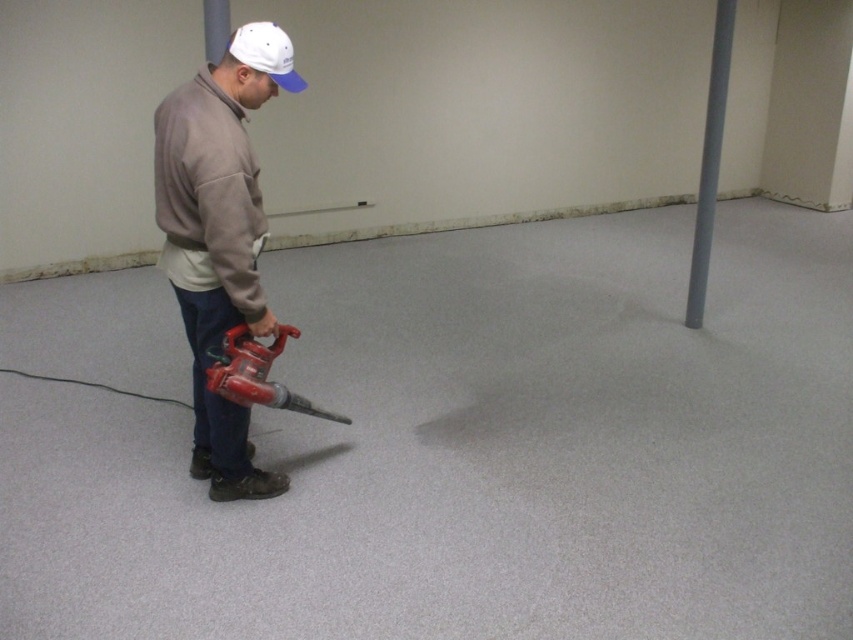
Based on the photo, you are a cleaning robot with a 1.5 meter operational radius. You are positioned at the camera location and need to clean the gray carpet at center. Can you reach it without moving?

The gray carpet at center is 2.12 meters away from camera, which is beyond the robot s 1.5 meter operational radius. Therefore, the robot cannot reach the gray carpet at center without moving.

You are standing at the point marked as point (x=123, y=561) in the room. You want to take a photo of the entire room using a camera that has a maximum focus range of 2.40 meters. Can you capture the entire room in one shot without moving the camera?

The distance between point (x=123, y=561) and the camera is exactly 2.40 meters. Since the camera can focus up to 2.40 meters, you can capture the entire room in one shot as the distance matches the maximum focus range.

You are a maintenance worker in the room. You need to check if the gray carpet at center is under the matte gray jacket at left. Is it true?

The gray carpet at center is located below matte gray jacket at left, so yes, the gray carpet at center is under the matte gray jacket at left.